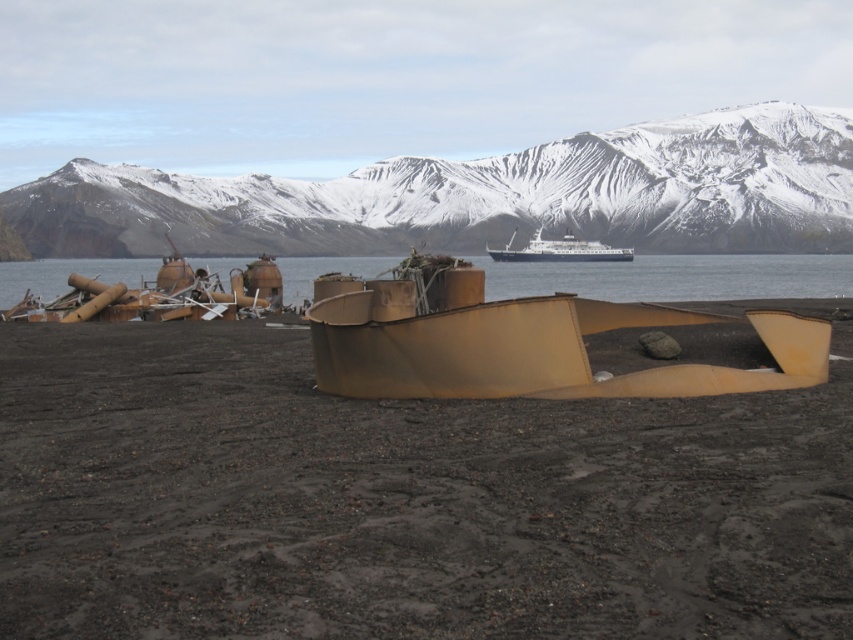
Can you confirm if rusty metallic debris at center is smaller than rusty metal boat at center?

Correct, rusty metallic debris at center occupies less space than rusty metal boat at center.

Is rusty metallic debris at center positioned behind rusty metal boat at center?

No, rusty metallic debris at center is closer to the viewer.

Where is `rusty metallic debris at center`? Image resolution: width=853 pixels, height=640 pixels. rusty metallic debris at center is located at coordinates (399, 500).

Does point (614, 278) come closer to viewer compared to point (518, 256)?

Yes, it is in front of point (518, 256).

Is point (693, 294) farther from camera compared to point (538, 241)?

That is False.

Is point (204, 266) less distant than point (619, 259)?

Yes, point (204, 266) is in front of point (619, 259).

The height and width of the screenshot is (640, 853). I want to click on brown matte water at center, so click(676, 276).

Can you confirm if rusty metallic debris at center is smaller than brown matte water at center?

Correct, rusty metallic debris at center occupies less space than brown matte water at center.

Does rusty metallic debris at center appear over brown matte water at center?

No, rusty metallic debris at center is not above brown matte water at center.

The image size is (853, 640). Describe the element at coordinates (399, 500) in the screenshot. I see `rusty metallic debris at center` at that location.

In order to click on rusty metallic debris at center in this screenshot , I will do `click(399, 500)`.